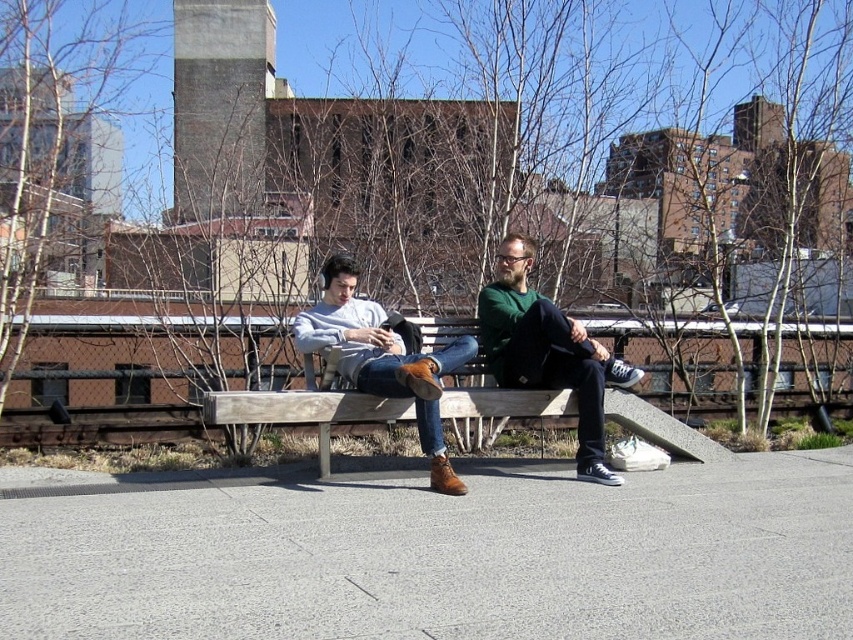
Question: Which point is closer to the camera taking this photo?

Choices:
 (A) (502, 268)
 (B) (413, 378)

Answer: (B)

Question: Among these objects, which one is farthest from the camera?

Choices:
 (A) matte brown leather shoes at center
 (B) matte leather shoes at center
 (C) green sweater at center

Answer: (C)

Question: Can you confirm if green sweater at center is wider than matte leather shoes at center?

Choices:
 (A) no
 (B) yes

Answer: (A)

Question: Which point is farther to the camera?

Choices:
 (A) matte leather shoes at center
 (B) matte brown leather shoes at center

Answer: (A)

Question: Is green sweater at center to the left of matte leather shoes at center from the viewer's perspective?

Choices:
 (A) yes
 (B) no

Answer: (B)

Question: Where is green sweater at center located in relation to matte leather shoes at center in the image?

Choices:
 (A) right
 (B) left

Answer: (A)